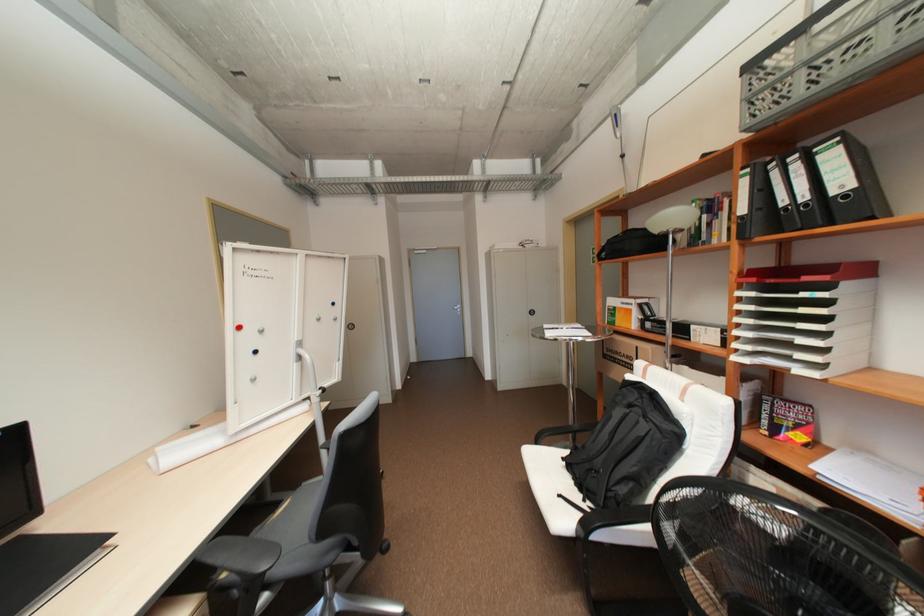
What are the coordinates of `door handle` in the screenshot? It's located at (457, 307).